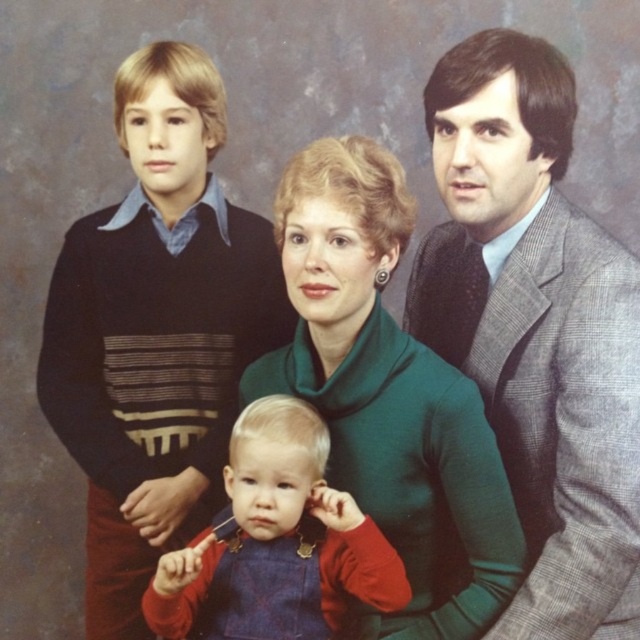
You are a photographer arranging a family portrait. You have two outfits to place on the right and center positions. The gray textured suit at right needs to be positioned so that it is 15.79 inches away from the red velvet overalls at center. Can you confirm if this distance will allow the outfits to be clearly visible without overlapping?

The gray textured suit at right is 15.79 inches away from the red velvet overalls at center, which ensures they are spaced apart sufficiently to avoid overlapping and remain clearly visible in the portrait.

You are an artist trying to paint this family portrait. You need to decide which of the two points, point (298, 196) or point (232, 436), should be closer to the viewer in your painting. Based on the image, which point should you place closer?

Point (298, 196) is closer to the camera than point (232, 436), so you should place point (298, 196) closer to the viewer in your painting.